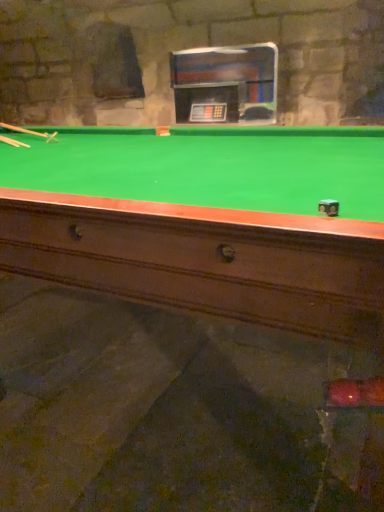
What do you see at coordinates (29, 131) in the screenshot? I see `wooden cue at left, arranged as the 1th cue when viewed from the top` at bounding box center [29, 131].

The image size is (384, 512). Identify the location of wooden cue at left, arranged as the 1th cue when viewed from the top. (29, 131).

Describe the element at coordinates (13, 142) in the screenshot. I see `wooden cue at left, which ranks as the first cue in bottom-to-top order` at that location.

I want to click on wooden cue at left, acting as the second cue starting from the top, so click(13, 142).

Locate an element on the screen. This screenshot has height=512, width=384. wooden cue at left, arranged as the 1th cue when viewed from the top is located at coordinates (29, 131).

Is wooden cue at left, arranged as the 1th cue when viewed from the top, at the right side of wooden cue at left, acting as the second cue starting from the top?

No, wooden cue at left, arranged as the 1th cue when viewed from the top, is not to the right of wooden cue at left, acting as the second cue starting from the top.

Does wooden cue at left, which is the 2th cue in bottom-to-top order, lie in front of wooden cue at left, which ranks as the first cue in bottom-to-top order?

No, wooden cue at left, which is the 2th cue in bottom-to-top order, is further to the viewer.

Which is in front, point (55, 138) or point (22, 146)?

The point (22, 146) is closer to the camera.

From the image's perspective, is wooden cue at left, arranged as the 1th cue when viewed from the top, above or below wooden cue at left, which ranks as the first cue in bottom-to-top order?

From the image's perspective, wooden cue at left, arranged as the 1th cue when viewed from the top, appears above wooden cue at left, which ranks as the first cue in bottom-to-top order.

From a real-world perspective, is wooden cue at left, which is the 2th cue in bottom-to-top order, physically above wooden cue at left, acting as the second cue starting from the top?

Yes.

Considering the relative sizes of wooden cue at left, which is the 2th cue in bottom-to-top order, and wooden cue at left, acting as the second cue starting from the top, in the image provided, is wooden cue at left, which is the 2th cue in bottom-to-top order, wider than wooden cue at left, acting as the second cue starting from the top,?

Yes, wooden cue at left, which is the 2th cue in bottom-to-top order, is wider than wooden cue at left, acting as the second cue starting from the top.

Who is shorter, wooden cue at left, which is the 2th cue in bottom-to-top order, or wooden cue at left, which ranks as the first cue in bottom-to-top order?

wooden cue at left, which ranks as the first cue in bottom-to-top order, is shorter.

Considering the sizes of objects wooden cue at left, which is the 2th cue in bottom-to-top order, and wooden cue at left, which ranks as the first cue in bottom-to-top order, in the image provided, who is bigger, wooden cue at left, which is the 2th cue in bottom-to-top order, or wooden cue at left, which ranks as the first cue in bottom-to-top order,?

wooden cue at left, which is the 2th cue in bottom-to-top order, is bigger.

Would you say wooden cue at left, which is the 2th cue in bottom-to-top order, is inside or outside wooden cue at left, acting as the second cue starting from the top?

wooden cue at left, which is the 2th cue in bottom-to-top order, lies outside wooden cue at left, acting as the second cue starting from the top.

Does wooden cue at left, which is the 2th cue in bottom-to-top order, turn towards wooden cue at left, which ranks as the first cue in bottom-to-top order?

No, wooden cue at left, which is the 2th cue in bottom-to-top order, is not oriented towards wooden cue at left, which ranks as the first cue in bottom-to-top order.

Can you tell me how much wooden cue at left, which is the 2th cue in bottom-to-top order, and wooden cue at left, acting as the second cue starting from the top, differ in facing direction?

The angular difference between wooden cue at left, which is the 2th cue in bottom-to-top order, and wooden cue at left, acting as the second cue starting from the top, is 2.21 degrees.

Based on the photo, how distant is wooden cue at left, arranged as the 1th cue when viewed from the top, from wooden cue at left, acting as the second cue starting from the top?

wooden cue at left, arranged as the 1th cue when viewed from the top, is 11.30 inches away from wooden cue at left, acting as the second cue starting from the top.

At what (x,y) coordinates should I click in order to perform the action: click on cue in front of the wooden cue at left, which is the 2th cue in bottom-to-top order. Please return your answer as a coordinate pair (x, y). This screenshot has width=384, height=512. Looking at the image, I should click on (13, 142).

Which is more to the right, wooden cue at left, acting as the second cue starting from the top, or wooden cue at left, arranged as the 1th cue when viewed from the top?

From the viewer's perspective, wooden cue at left, acting as the second cue starting from the top, appears more on the right side.

Considering their positions, is wooden cue at left, which ranks as the first cue in bottom-to-top order, located in front of or behind wooden cue at left, arranged as the 1th cue when viewed from the top?

wooden cue at left, which ranks as the first cue in bottom-to-top order, is positioned closer to the viewer than wooden cue at left, arranged as the 1th cue when viewed from the top.

Is point (4, 138) more distant than point (45, 137)?

No, (4, 138) is closer to viewer.

From the image's perspective, does wooden cue at left, acting as the second cue starting from the top, appear lower than wooden cue at left, arranged as the 1th cue when viewed from the top?

Yes, from the image's perspective, wooden cue at left, acting as the second cue starting from the top, is below wooden cue at left, arranged as the 1th cue when viewed from the top.

From a real-world perspective, which is physically below, wooden cue at left, acting as the second cue starting from the top, or wooden cue at left, which is the 2th cue in bottom-to-top order?

In real-world perspective, wooden cue at left, acting as the second cue starting from the top, is lower.

Which object is wider, wooden cue at left, acting as the second cue starting from the top, or wooden cue at left, which is the 2th cue in bottom-to-top order?

wooden cue at left, which is the 2th cue in bottom-to-top order, is wider.

Considering the sizes of objects wooden cue at left, acting as the second cue starting from the top, and wooden cue at left, arranged as the 1th cue when viewed from the top, in the image provided, who is taller, wooden cue at left, acting as the second cue starting from the top, or wooden cue at left, arranged as the 1th cue when viewed from the top,?

Standing taller between the two is wooden cue at left, arranged as the 1th cue when viewed from the top.

Based on their sizes in the image, would you say wooden cue at left, acting as the second cue starting from the top, is bigger or smaller than wooden cue at left, which is the 2th cue in bottom-to-top order?

Clearly, wooden cue at left, acting as the second cue starting from the top, is smaller in size than wooden cue at left, which is the 2th cue in bottom-to-top order.

Can wooden cue at left, arranged as the 1th cue when viewed from the top, be found inside wooden cue at left, acting as the second cue starting from the top?

No, wooden cue at left, arranged as the 1th cue when viewed from the top, is not surrounded by wooden cue at left, acting as the second cue starting from the top.

Is wooden cue at left, acting as the second cue starting from the top, placed right next to wooden cue at left, which is the 2th cue in bottom-to-top order?

No.

Could you tell me if wooden cue at left, acting as the second cue starting from the top, is turned towards wooden cue at left, arranged as the 1th cue when viewed from the top?

No, wooden cue at left, acting as the second cue starting from the top, is not oriented towards wooden cue at left, arranged as the 1th cue when viewed from the top.

Can you tell me how much wooden cue at left, which ranks as the first cue in bottom-to-top order, and wooden cue at left, arranged as the 1th cue when viewed from the top, differ in facing direction?

2.21 degrees.

Locate an element on the screen. Image resolution: width=384 pixels, height=512 pixels. cue above the wooden cue at left, which ranks as the first cue in bottom-to-top order (from a real-world perspective) is located at coordinates click(29, 131).

Where is `cue located above the wooden cue at left, which ranks as the first cue in bottom-to-top order (from the image's perspective)`? Image resolution: width=384 pixels, height=512 pixels. cue located above the wooden cue at left, which ranks as the first cue in bottom-to-top order (from the image's perspective) is located at coordinates (29, 131).

Image resolution: width=384 pixels, height=512 pixels. What are the coordinates of `cue below the wooden cue at left, which is the 2th cue in bottom-to-top order (from the image's perspective)` in the screenshot? It's located at (13, 142).